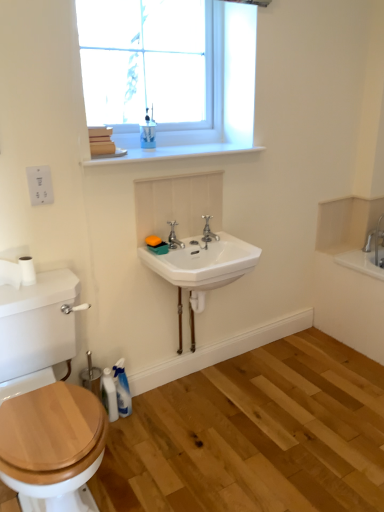
Question: From a real-world perspective, is white ceramic sink at center positioned under polished chrome faucet at center, acting as the second tap starting from the left, based on gravity?

Choices:
 (A) no
 (B) yes

Answer: (B)

Question: Considering the relative sizes of white ceramic sink at center and polished chrome faucet at center, marked as the 1th tap in a right-to-left arrangement, in the image provided, is white ceramic sink at center shorter than polished chrome faucet at center, marked as the 1th tap in a right-to-left arrangement,?

Choices:
 (A) yes
 (B) no

Answer: (B)

Question: Is white ceramic sink at center next to polished chrome faucet at center, marked as the 1th tap in a right-to-left arrangement?

Choices:
 (A) yes
 (B) no

Answer: (B)

Question: Could polished chrome faucet at center, acting as the second tap starting from the left, be considered to be inside white ceramic sink at center?

Choices:
 (A) yes
 (B) no

Answer: (B)

Question: Is the position of white ceramic sink at center more distant than that of polished chrome faucet at center, marked as the 1th tap in a right-to-left arrangement?

Choices:
 (A) yes
 (B) no

Answer: (B)

Question: From the image's perspective, relative to blue glossy cup at upper center, acting as the 1th toiletry starting from the top, is white ceramic sink at center above or below?

Choices:
 (A) above
 (B) below

Answer: (B)

Question: Relative to blue glossy cup at upper center, acting as the 1th toiletry starting from the top, is white ceramic sink at center in front or behind?

Choices:
 (A) front
 (B) behind

Answer: (A)

Question: Is white ceramic sink at center bigger or smaller than blue glossy cup at upper center, the 1th toiletry viewed from the right?

Choices:
 (A) big
 (B) small

Answer: (A)

Question: Considering the positions of white ceramic sink at center and blue glossy cup at upper center, the 1th toiletry viewed from the right, in the image, is white ceramic sink at center taller or shorter than blue glossy cup at upper center, the 1th toiletry viewed from the right,?

Choices:
 (A) short
 (B) tall

Answer: (A)

Question: Is blue glossy cup at upper center, the 1th toiletry viewed from the right, situated inside clear glass window at upper center or outside?

Choices:
 (A) inside
 (B) outside

Answer: (B)

Question: Visually, is blue glossy cup at upper center, the 2th toiletry when ordered from left to right, positioned to the left or to the right of clear glass window at upper center?

Choices:
 (A) right
 (B) left

Answer: (B)

Question: In the image, is blue glossy cup at upper center, the 2th toiletry when ordered from left to right, positioned in front of or behind clear glass window at upper center?

Choices:
 (A) front
 (B) behind

Answer: (B)

Question: Looking at their shapes, would you say blue glossy cup at upper center, the 2th toiletry when ordered from left to right, is wider or thinner than clear glass window at upper center?

Choices:
 (A) thin
 (B) wide

Answer: (A)

Question: In the image, is white glossy bottle at lower left positioned in front of or behind silver metallic faucet at center, which appears as the second tap when viewed from the right?

Choices:
 (A) behind
 (B) front

Answer: (A)

Question: Is point (110, 409) positioned closer to the camera than point (178, 244)?

Choices:
 (A) farther
 (B) closer

Answer: (B)